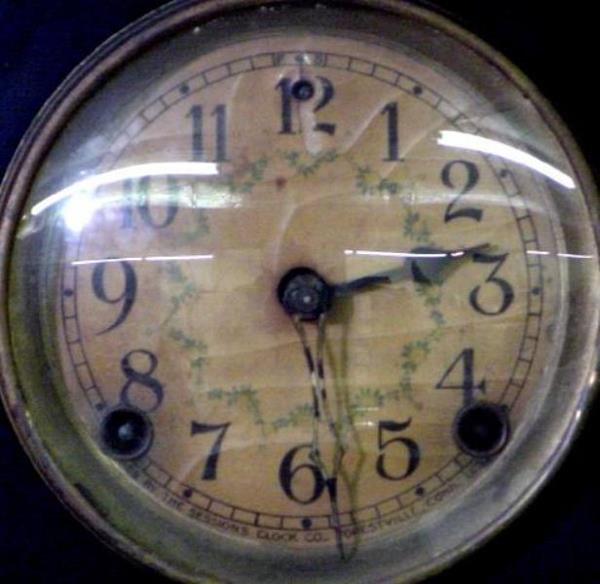
You are a GUI agent. You are given a task and a screenshot of the screen. Output one action in this format:
    pyautogui.click(x=<x>, y=<y>)
    Task: Click on the casing
    This screenshot has height=584, width=600.
    Given the screenshot: What is the action you would take?
    pyautogui.click(x=92, y=69)